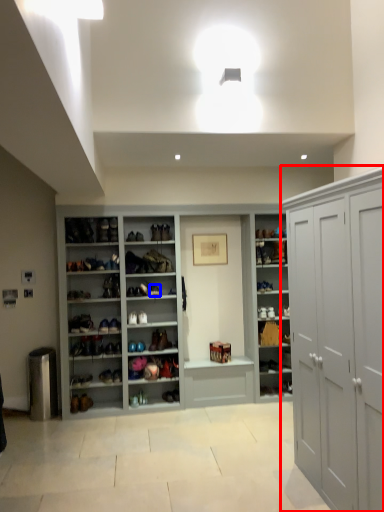
Question: Which object is further to the camera taking this photo, cabinetry (highlighted by a red box) or shoe (highlighted by a blue box)?

Choices:
 (A) cabinetry
 (B) shoe

Answer: (B)